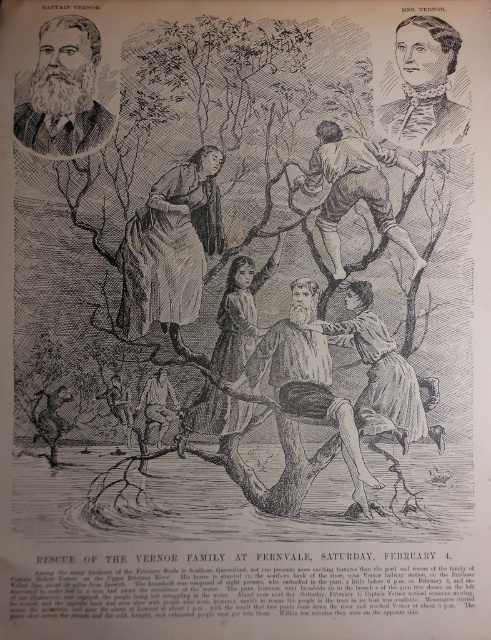
You are an observer analyzing the rescue scene. The image has a coordinate system where the bottom left corner is the origin. Where is the smooth brown skin at upper center positioned in terms of coordinates?

The smooth brown skin at upper center is located at point (354,188).

In the rescue scene, how far apart are the smooth brown skin at upper center and the smooth brown dress at center?

The smooth brown skin at upper center and the smooth brown dress at center are 8.35 inches apart.